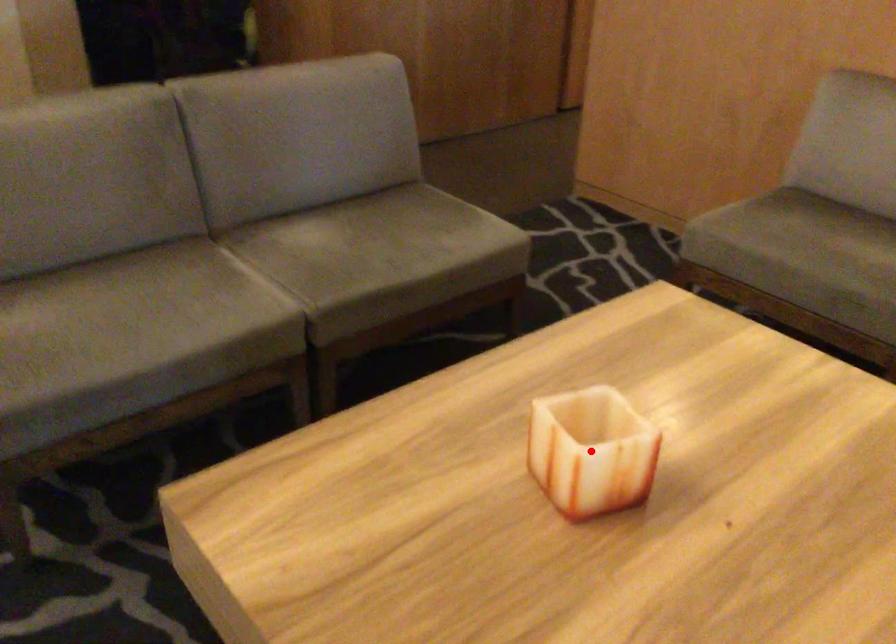
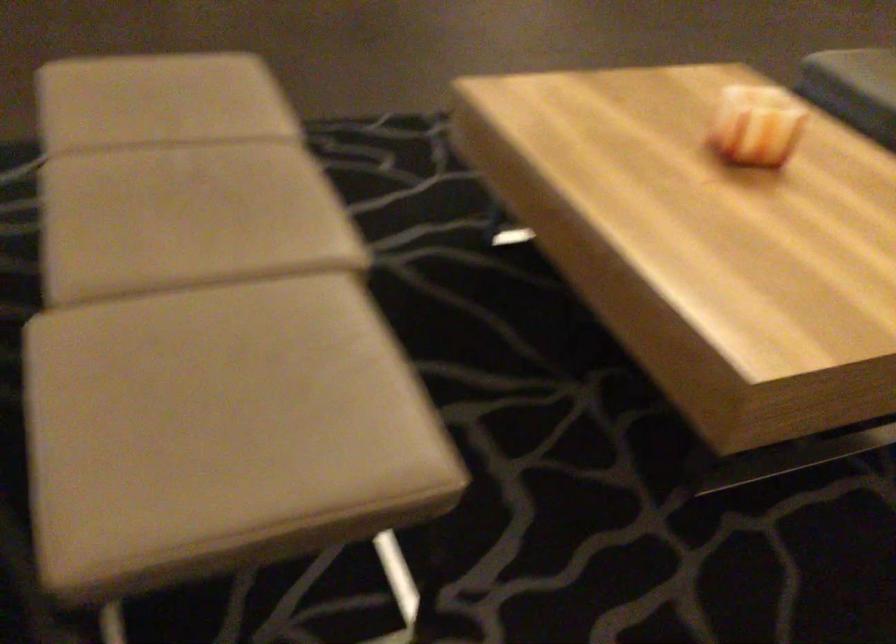
Question: I am providing you with two images of the same scene from different viewpoints. Given a red point in image1, look at the same physical point in image2. Is it:

Choices:
 (A) Closer to the viewpoint
 (B) Farther from the viewpoint

Answer: (B)